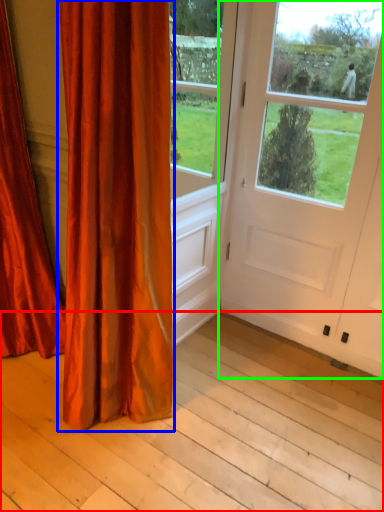
Question: Which is farther away from plank (highlighted by a red box)? curtain (highlighted by a blue box) or door (highlighted by a green box)?

Choices:
 (A) curtain
 (B) door

Answer: (B)